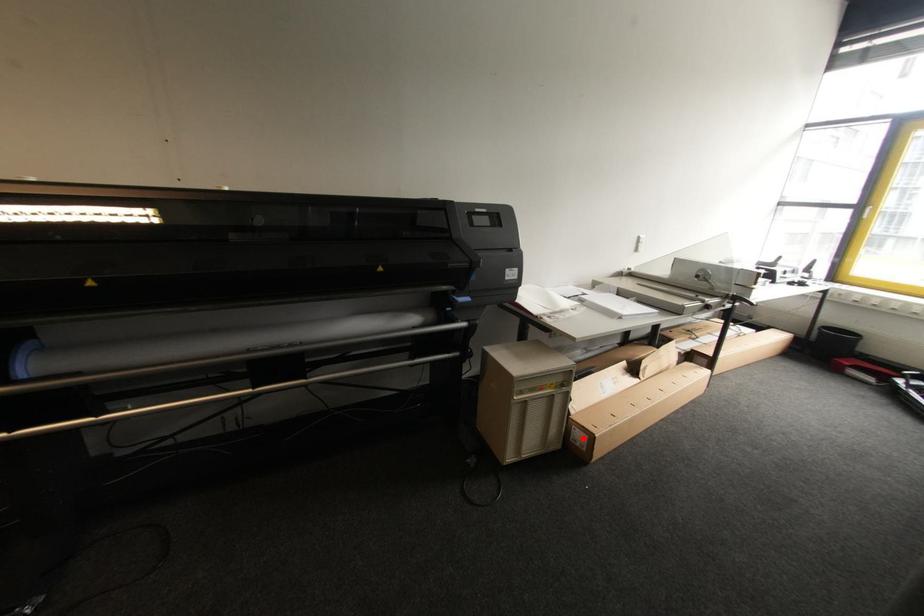
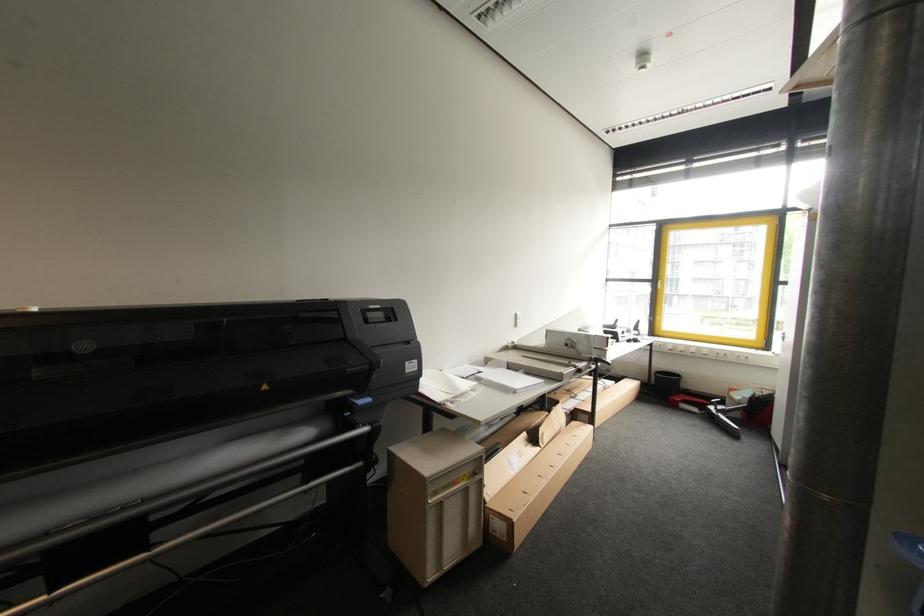
Question: I am providing you with two images of the same scene from different viewpoints. In image1, a red point is highlighted. Considering the same 3D point in image2, which of the following is correct?

Choices:
 (A) It is closer
 (B) It is farther

Answer: (A)